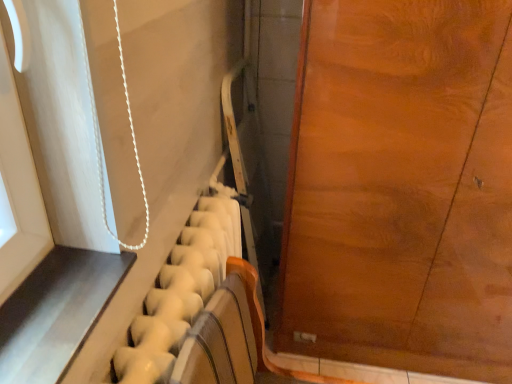
Identify the location of wooden door at center. The image size is (512, 384). (402, 188).

Describe the element at coordinates (402, 188) in the screenshot. I see `wooden door at center` at that location.

Where is `wooden door at center`? The height and width of the screenshot is (384, 512). wooden door at center is located at coordinates (402, 188).